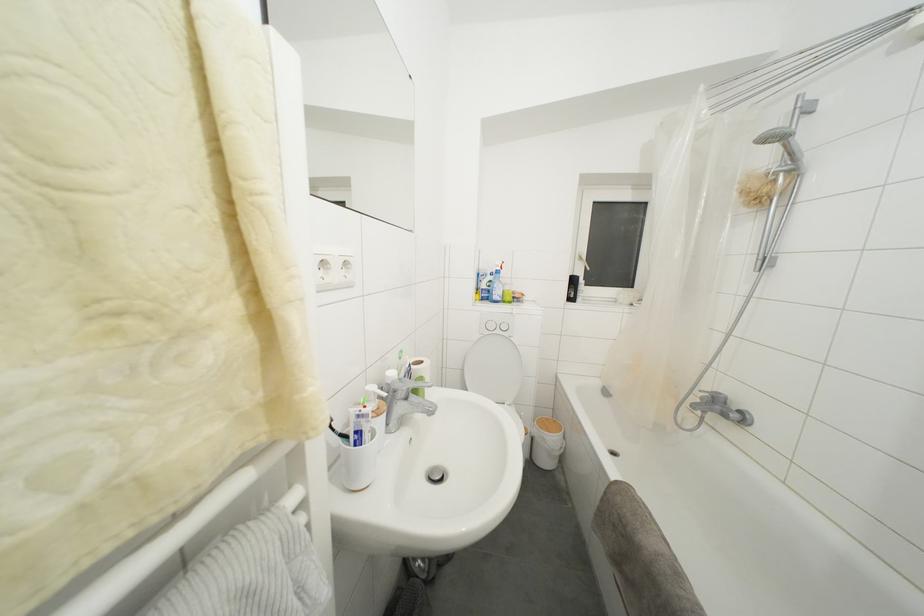
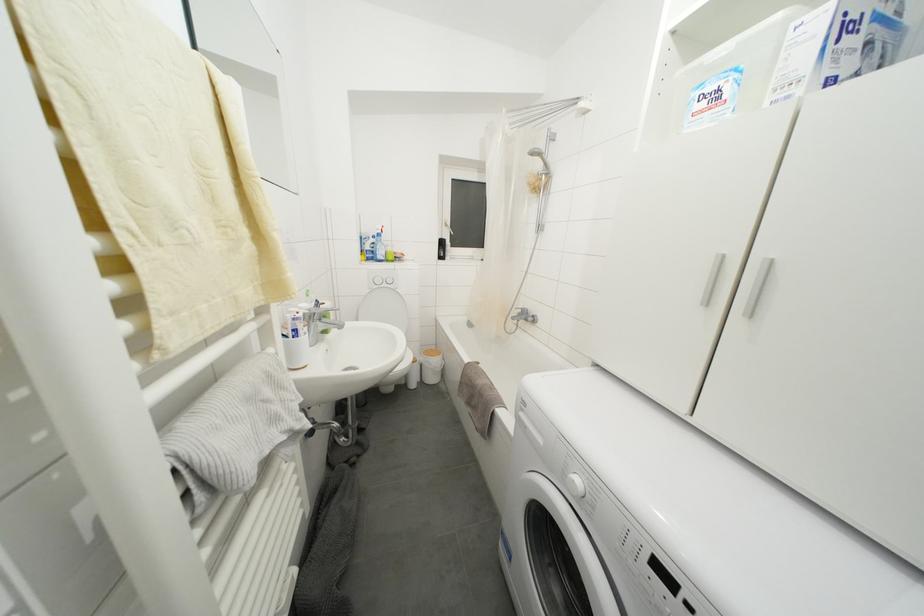
Question: Which direction would the cameraman need to move to produce the second image? Reply with the corresponding letter.

Choices:
 (A) Left
 (B) Right
 (C) Forward
 (D) Backward

Answer: (D)